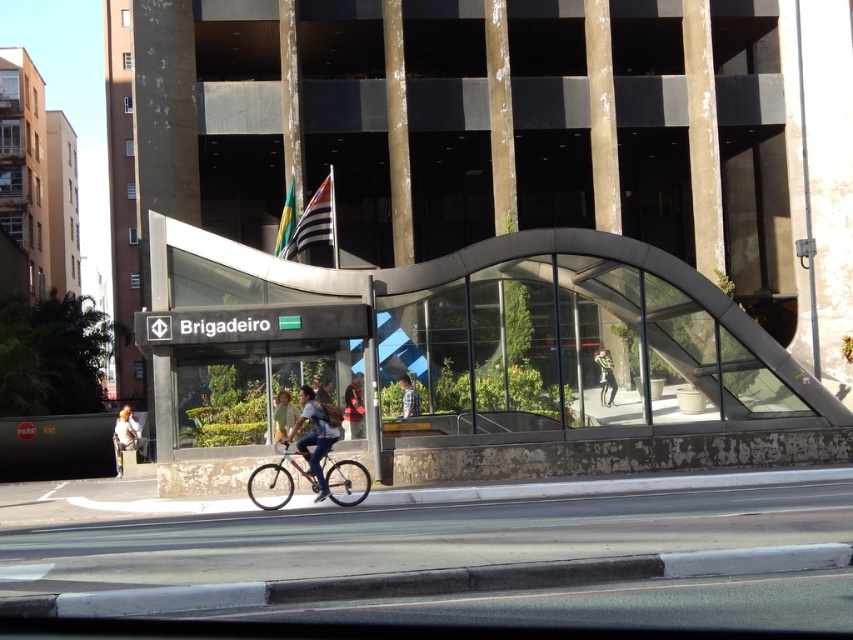
Which is more to the left, black and white striped pants at center or light blue jeans at center?

From the viewer's perspective, light blue jeans at center appears more on the left side.

Between point (608, 394) and point (399, 387), which one is positioned behind?

Point (608, 394)

This screenshot has width=853, height=640. What are the coordinates of `black and white striped pants at center` in the screenshot? It's located at (605, 376).

This screenshot has width=853, height=640. What do you see at coordinates (352, 408) in the screenshot? I see `red fabric jacket at center` at bounding box center [352, 408].

Does point (357, 422) come closer to viewer compared to point (601, 387)?

Yes, it is in front of point (601, 387).

The height and width of the screenshot is (640, 853). I want to click on red fabric jacket at center, so click(x=352, y=408).

Where is `red fabric jacket at center`? The width and height of the screenshot is (853, 640). red fabric jacket at center is located at coordinates (352, 408).

Can you confirm if denim jacket at center is bigger than light brown leather jacket at center?

Indeed, denim jacket at center has a larger size compared to light brown leather jacket at center.

Which is more to the right, denim jacket at center or light brown leather jacket at center?

denim jacket at center

This screenshot has width=853, height=640. In order to click on denim jacket at center in this screenshot , I will do `click(312, 436)`.